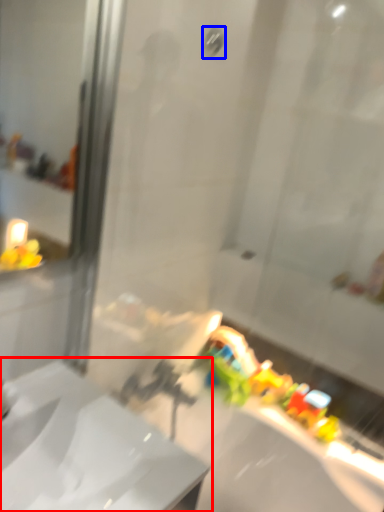
Question: Which object appears farthest to the camera in this image, sink (highlighted by a red box) or shower (highlighted by a blue box)?

Choices:
 (A) sink
 (B) shower

Answer: (B)